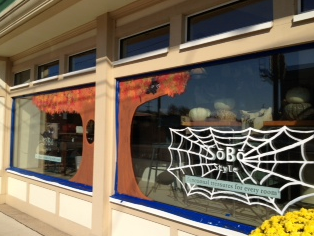
Find the location of `decorative spiderweb`. decorative spiderweb is located at coordinates (210, 135).